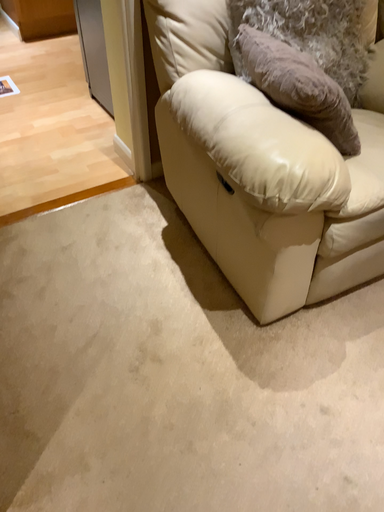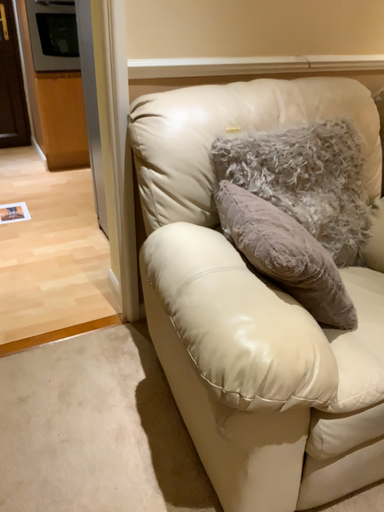
Question: Which way did the camera rotate in the video?

Choices:
 (A) rotated upward
 (B) rotated downward

Answer: (A)